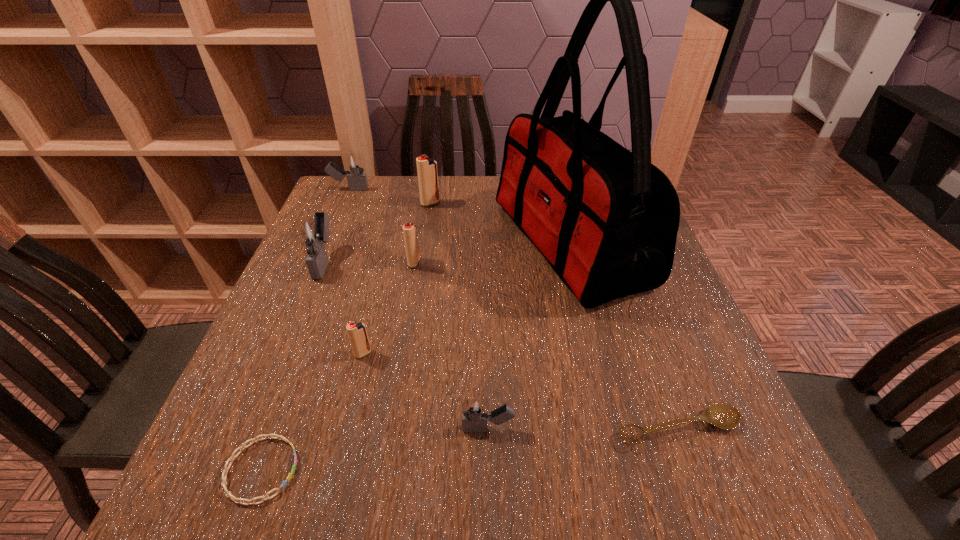
Where is `object that is positioned at the near left corner`? object that is positioned at the near left corner is located at coordinates (237, 500).

This screenshot has width=960, height=540. What are the coordinates of `object that is at the far right corner` in the screenshot? It's located at (606, 219).

In the image, there is a desktop. At what (x,y) coordinates should I click in order to perform the action: click on vacant space at the far edge. Please return your answer as a coordinate pair (x, y). Looking at the image, I should click on (484, 185).

You are a GUI agent. You are given a task and a screenshot of the screen. Output one action in this format:
    pyautogui.click(x=<x>, y=<y>)
    Task: Click on the free space at the near edge of the desktop
    
    Given the screenshot: What is the action you would take?
    pyautogui.click(x=400, y=458)

Find the location of a particular element. vacant space at the left edge of the desktop is located at coordinates (298, 323).

At what (x,y) coordinates should I click in order to perform the action: click on vacant space at the right edge. Please return your answer as a coordinate pair (x, y). Looking at the image, I should click on (687, 431).

In the image, there is a desktop. Where is `free space at the far left corner`? The height and width of the screenshot is (540, 960). free space at the far left corner is located at coordinates (382, 182).

The width and height of the screenshot is (960, 540). What are the coordinates of `vacant region at the near left corner of the desktop` in the screenshot? It's located at (275, 508).

The width and height of the screenshot is (960, 540). In order to click on vacant space that's between the second nearest red igniter and the duffel bag in this screenshot , I will do `click(492, 254)`.

Image resolution: width=960 pixels, height=540 pixels. Find the location of `free point between the duffel bag and the second nearest gray igniter`. free point between the duffel bag and the second nearest gray igniter is located at coordinates (447, 253).